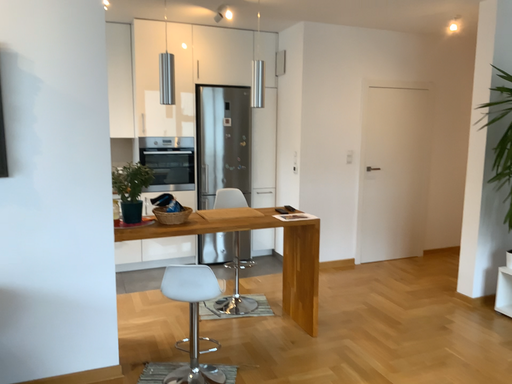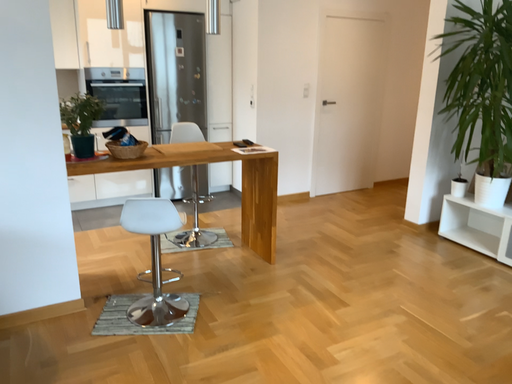
Question: Which way did the camera rotate in the video?

Choices:
 (A) rotated downward
 (B) rotated upward

Answer: (A)